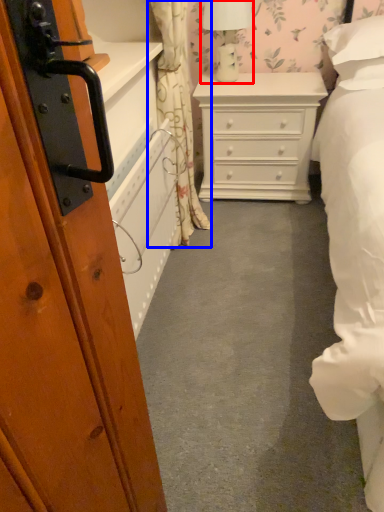
Question: Which of the following is the closest to the observer, table lamp (highlighted by a red box) or curtain (highlighted by a blue box)?

Choices:
 (A) table lamp
 (B) curtain

Answer: (B)